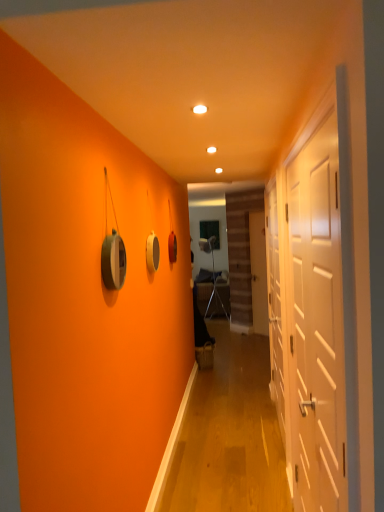
Question: Does white matte door at right, positioned as the second door in right-to-left order, turn towards metallic silver armchair at center?

Choices:
 (A) yes
 (B) no

Answer: (B)

Question: Is white matte door at right, positioned as the second door in right-to-left order, beside metallic silver armchair at center?

Choices:
 (A) yes
 (B) no

Answer: (B)

Question: Considering the relative positions of white matte door at right, which is the second door from back to front, and metallic silver armchair at center in the image provided, is white matte door at right, which is the second door from back to front, behind metallic silver armchair at center?

Choices:
 (A) no
 (B) yes

Answer: (A)

Question: Is white matte door at right, the second door viewed from the left, at the left side of metallic silver armchair at center?

Choices:
 (A) no
 (B) yes

Answer: (A)

Question: Does white matte door at right, the second door viewed from the front, contain metallic silver armchair at center?

Choices:
 (A) no
 (B) yes

Answer: (A)

Question: Is white matte door at center, which is the 1th door in back-to-front order, inside the boundaries of white glossy door at right, the third door from the back, or outside?

Choices:
 (A) inside
 (B) outside

Answer: (B)

Question: Based on their positions, is white matte door at center, placed as the third door when sorted from left to right, located to the left or right of white glossy door at right, marked as the 1th door in a front-to-back arrangement?

Choices:
 (A) right
 (B) left

Answer: (A)

Question: From a real-world perspective, is white matte door at center, placed as the third door when sorted from left to right, above or below white glossy door at right, which ranks as the 3th door in right-to-left order?

Choices:
 (A) above
 (B) below

Answer: (B)

Question: From the image's perspective, is white matte door at center, which appears as the first door when viewed from the right, positioned above or below white glossy door at right, which ranks as the 3th door in right-to-left order?

Choices:
 (A) below
 (B) above

Answer: (B)

Question: In the image, is metallic silver armchair at center positioned in front of or behind white matte door at right, the second door viewed from the front?

Choices:
 (A) behind
 (B) front

Answer: (A)

Question: Is metallic silver armchair at center wider or thinner than white matte door at right, positioned as the second door in right-to-left order?

Choices:
 (A) wide
 (B) thin

Answer: (A)

Question: From a real-world perspective, is metallic silver armchair at center above or below white matte door at right, which is the second door from back to front?

Choices:
 (A) below
 (B) above

Answer: (A)

Question: Based on their sizes in the image, would you say metallic silver armchair at center is bigger or smaller than white matte door at right, which is the second door from back to front?

Choices:
 (A) big
 (B) small

Answer: (A)

Question: Considering the positions of point (314, 236) and point (278, 394), is point (314, 236) closer or farther from the camera than point (278, 394)?

Choices:
 (A) farther
 (B) closer

Answer: (B)

Question: Is white glossy door at right, marked as the 1th door in a front-to-back arrangement, wider or thinner than white matte door at right, positioned as the second door in right-to-left order?

Choices:
 (A) wide
 (B) thin

Answer: (B)